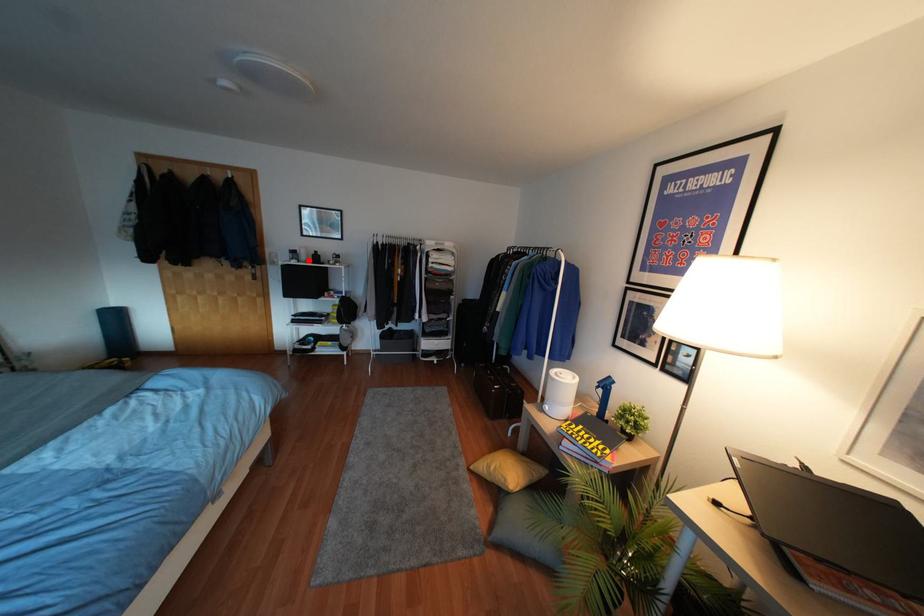
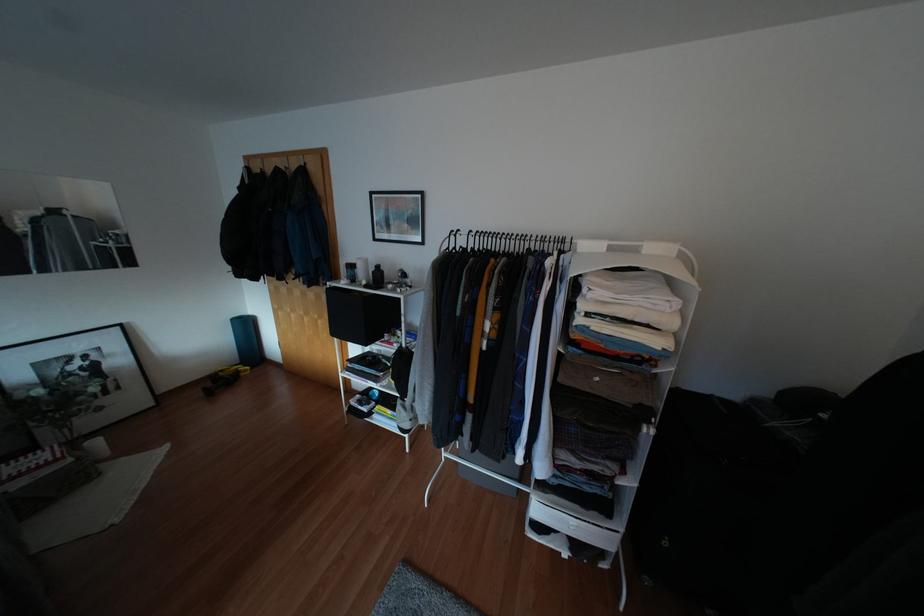
Question: I am providing you with two images of the same scene from different viewpoints. A red point is marked on the first image. Can you still see the location of the red point in image 2?

Choices:
 (A) Yes
 (B) No

Answer: (A)